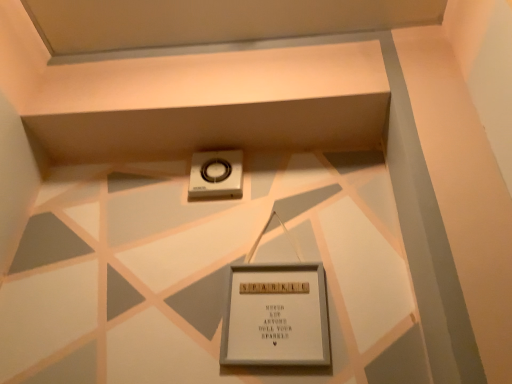
Question: Is silver metallic scale at center bigger or smaller than white wooden picture frame at center?

Choices:
 (A) small
 (B) big

Answer: (A)

Question: Considering the positions of silver metallic scale at center and white wooden picture frame at center in the image, is silver metallic scale at center taller or shorter than white wooden picture frame at center?

Choices:
 (A) short
 (B) tall

Answer: (A)

Question: From the image's perspective, is silver metallic scale at center located above or below white wooden picture frame at center?

Choices:
 (A) above
 (B) below

Answer: (A)

Question: From the image's perspective, is white wooden picture frame at center positioned above or below silver metallic scale at center?

Choices:
 (A) below
 (B) above

Answer: (A)

Question: From their relative heights in the image, would you say white wooden picture frame at center is taller or shorter than silver metallic scale at center?

Choices:
 (A) tall
 (B) short

Answer: (A)

Question: Is point (306, 327) positioned closer to the camera than point (236, 190)?

Choices:
 (A) farther
 (B) closer

Answer: (B)

Question: Would you say white wooden picture frame at center is inside or outside silver metallic scale at center?

Choices:
 (A) inside
 (B) outside

Answer: (B)